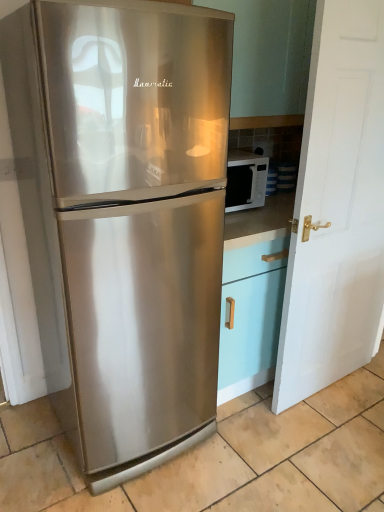
Question: Is white glossy microwave at right inside the boundaries of white matte door at right, or outside?

Choices:
 (A) outside
 (B) inside

Answer: (A)

Question: In terms of height, does white glossy microwave at right look taller or shorter compared to white matte door at right?

Choices:
 (A) short
 (B) tall

Answer: (A)

Question: Which is nearer to the white glossy microwave at right?

Choices:
 (A) white matte door at right
 (B) stainless steel refrigerator at left

Answer: (A)

Question: Which object is the closest to the white matte door at right?

Choices:
 (A) stainless steel refrigerator at left
 (B) white glossy microwave at right

Answer: (B)